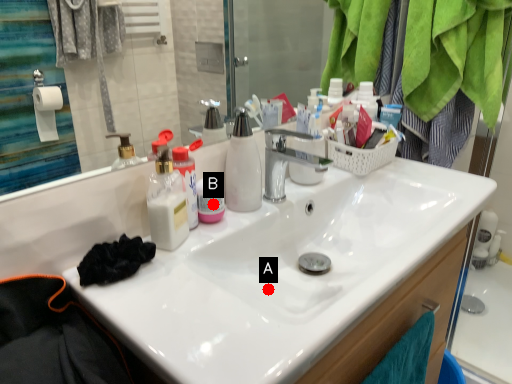
Question: Two points are circled on the image, labeled by A and B beside each circle. Which point is farther to the camera?

Choices:
 (A) A is further
 (B) B is further

Answer: (B)